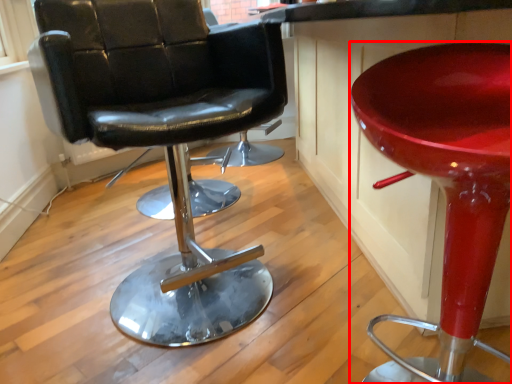
Question: From the image's perspective, where is stool (annotated by the red box) located in relation to chair in the image?

Choices:
 (A) above
 (B) below

Answer: (B)